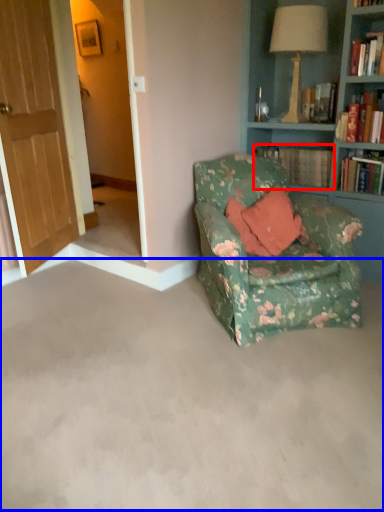
Question: Which point is closer to the camera, book (highlighted by a red box) or concrete (highlighted by a blue box)?

Choices:
 (A) book
 (B) concrete

Answer: (B)